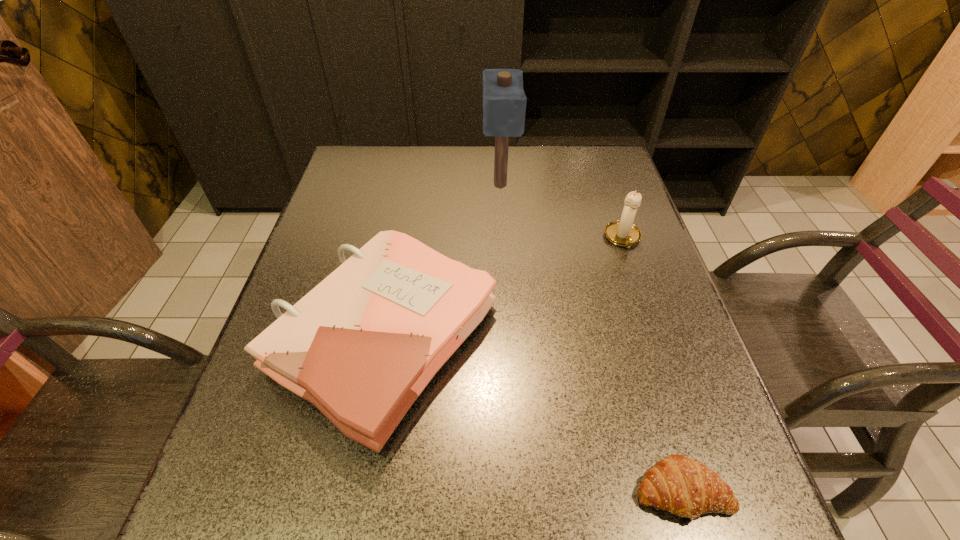
Find the location of `the tallest object`. the tallest object is located at coordinates (504, 101).

Where is `mallet`? mallet is located at coordinates (504, 101).

In order to click on the second tallest object in this screenshot , I will do `click(623, 233)`.

Where is `the second farthest object`? This screenshot has width=960, height=540. the second farthest object is located at coordinates (623, 233).

Find the location of a particular element. the third tallest object is located at coordinates (361, 346).

Locate an element on the screen. The width and height of the screenshot is (960, 540). phonebook is located at coordinates (361, 346).

Locate an element on the screen. crescent roll is located at coordinates (677, 484).

Locate an element on the screen. Image resolution: width=960 pixels, height=540 pixels. the shortest object is located at coordinates (677, 484).

This screenshot has width=960, height=540. I want to click on vacant area situated 0.390m on the left of the mallet, so click(x=351, y=184).

The image size is (960, 540). Identify the location of free space located on the handle side of the third nearest object. (x=675, y=392).